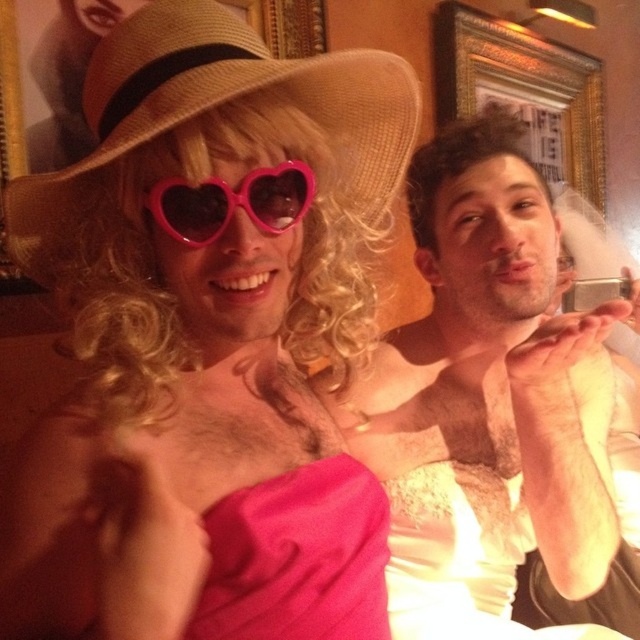
Question: Among these objects, which one is farthest from the camera?

Choices:
 (A) pink heart-shaped sunglasses at center
 (B) straw hat at left
 (C) matte white dress at center
 (D) pink matte heart-shaped sunglasses at upper left

Answer: (C)

Question: Which object appears closest to the camera in this image?

Choices:
 (A) pink heart-shaped sunglasses at center
 (B) matte white dress at center
 (C) pink matte heart-shaped sunglasses at upper left
 (D) straw hat at left

Answer: (C)

Question: Estimate the real-world distances between objects in this image. Which object is closer to the straw hat at left?

Choices:
 (A) pink heart-shaped sunglasses at center
 (B) matte white dress at center
 (C) pink matte heart-shaped sunglasses at upper left

Answer: (C)

Question: Is pink matte heart-shaped sunglasses at upper left to the right of matte white dress at center from the viewer's perspective?

Choices:
 (A) no
 (B) yes

Answer: (A)

Question: From the image, what is the correct spatial relationship of matte white dress at center in relation to straw hat at left?

Choices:
 (A) below
 (B) above

Answer: (A)

Question: Can you confirm if pink matte heart-shaped sunglasses at upper left is positioned to the left of pink heart-shaped sunglasses at center?

Choices:
 (A) no
 (B) yes

Answer: (B)